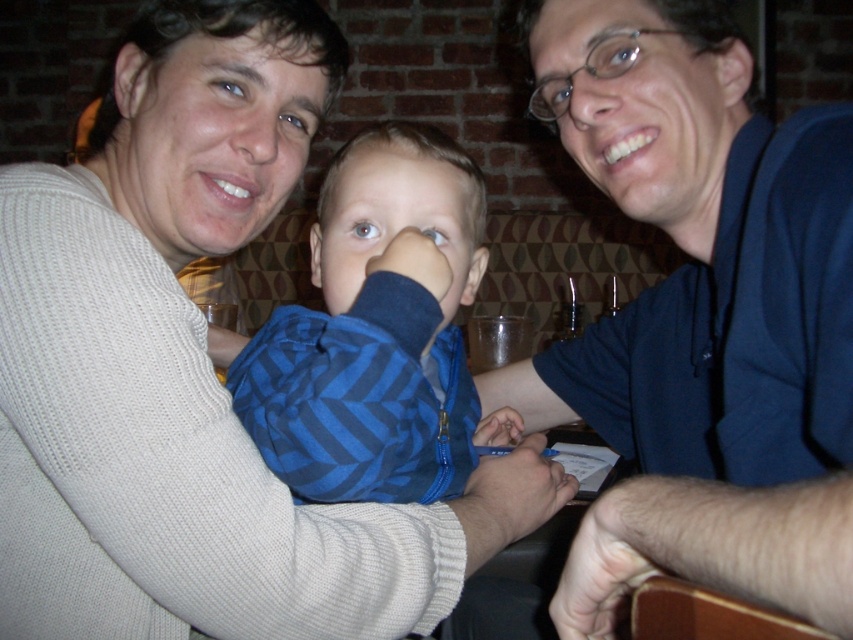
Which is more to the left, white knit sweater at upper left or blue shirt at center?

From the viewer's perspective, white knit sweater at upper left appears more on the left side.

Which is above, white knit sweater at upper left or blue shirt at center?

Positioned higher is blue shirt at center.

Which is behind, point (236, 0) or point (851, 246)?

The point (236, 0) is more distant.

The image size is (853, 640). Find the location of `white knit sweater at upper left`. white knit sweater at upper left is located at coordinates (193, 371).

Which is behind, point (740, 376) or point (474, 275)?

The point (474, 275) is behind.

The height and width of the screenshot is (640, 853). What do you see at coordinates (703, 328) in the screenshot? I see `blue shirt at center` at bounding box center [703, 328].

Locate an element on the screen. blue shirt at center is located at coordinates (703, 328).

Can you confirm if white knit sweater at upper left is thinner than blue striped shirt at center?

Incorrect, white knit sweater at upper left's width is not less than blue striped shirt at center's.

Which is below, white knit sweater at upper left or blue striped shirt at center?

blue striped shirt at center is lower down.

In order to click on white knit sweater at upper left in this screenshot , I will do [193, 371].

Where is `white knit sweater at upper left`? white knit sweater at upper left is located at coordinates (193, 371).